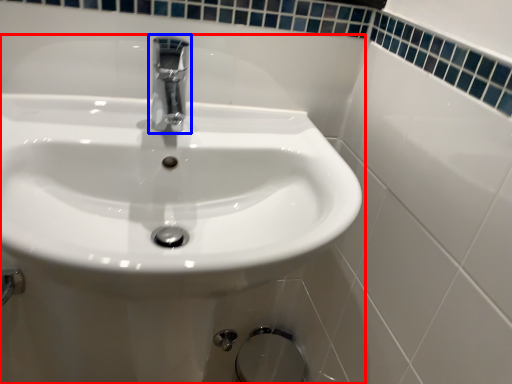
Question: Which point is further to the camera, sink (highlighted by a red box) or tap (highlighted by a blue box)?

Choices:
 (A) sink
 (B) tap

Answer: (B)